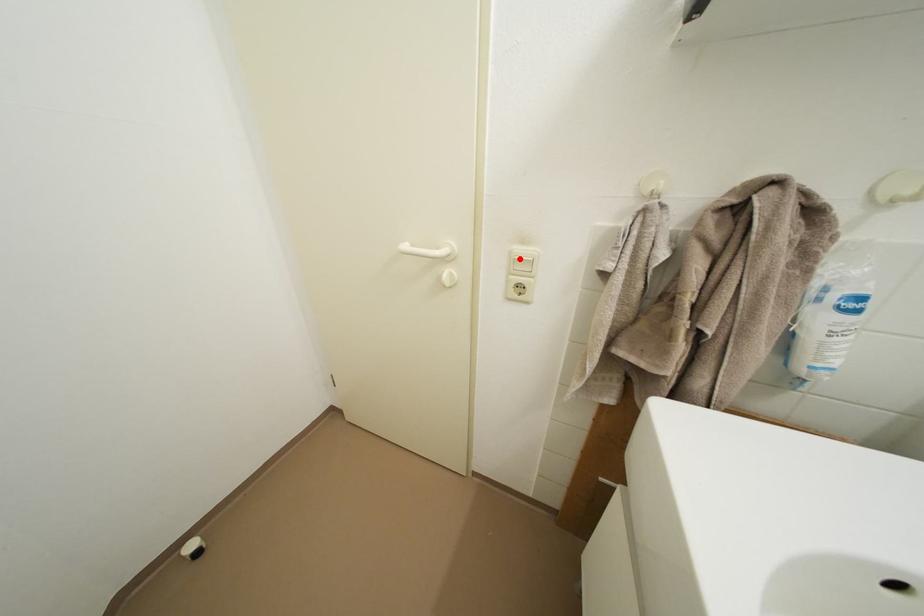
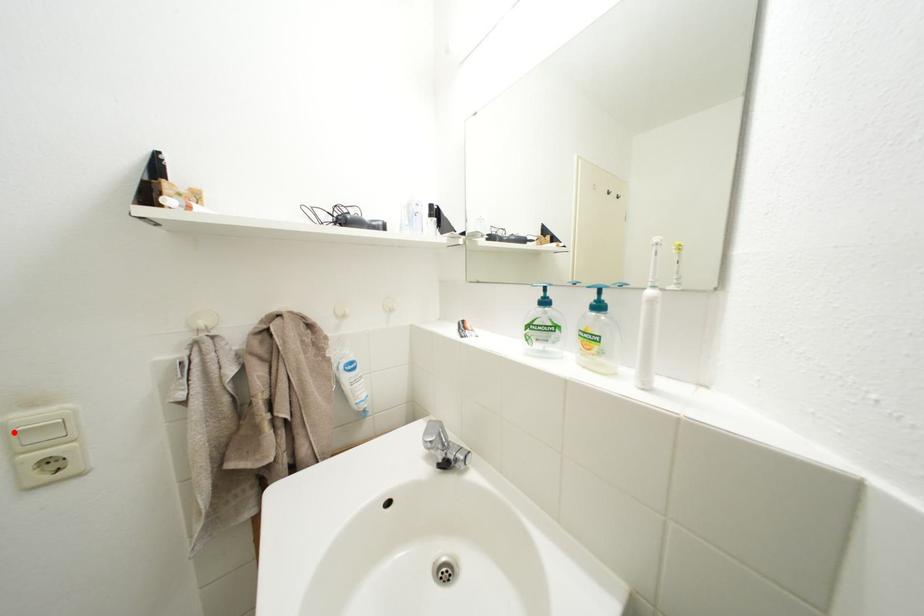
I am providing you with two images of the same scene from different viewpoints. A red point is marked on the first image and another point is marked on the second image. Do the highlighted points in image1 and image2 indicate the same real-world spot?

Yes